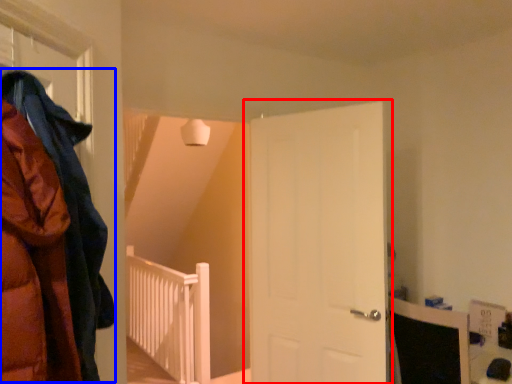
Question: Which object is further to the camera taking this photo, door (highlighted by a red box) or cloak (highlighted by a blue box)?

Choices:
 (A) door
 (B) cloak

Answer: (A)